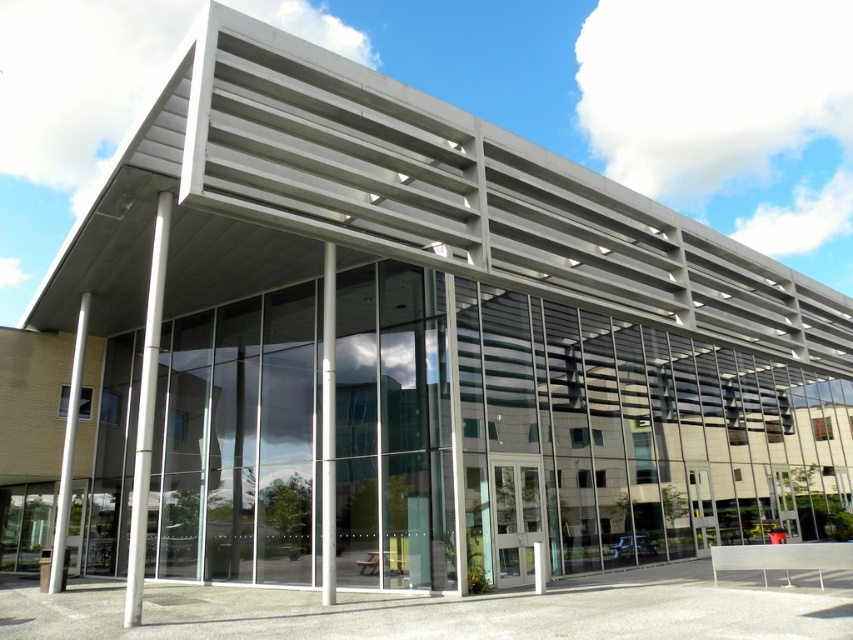
Question: Can you confirm if silver metallic pole at left is thinner than clear glass pillar at center?

Choices:
 (A) no
 (B) yes

Answer: (A)

Question: Does clear glass pillar at center have a smaller size compared to white glossy pole at left?

Choices:
 (A) yes
 (B) no

Answer: (B)

Question: Can you confirm if clear glass pillar at center is positioned to the right of white glossy pole at left?

Choices:
 (A) no
 (B) yes

Answer: (B)

Question: Which object is positioned closest to the white glossy pole at left?

Choices:
 (A) clear glass pillar at center
 (B) silver metallic pole at left

Answer: (B)

Question: Which of the following is the closest to the observer?

Choices:
 (A) (151, 448)
 (B) (326, 394)

Answer: (B)

Question: Which point is closer to the camera taking this photo?

Choices:
 (A) (79, 349)
 (B) (138, 561)
 (C) (323, 518)

Answer: (B)